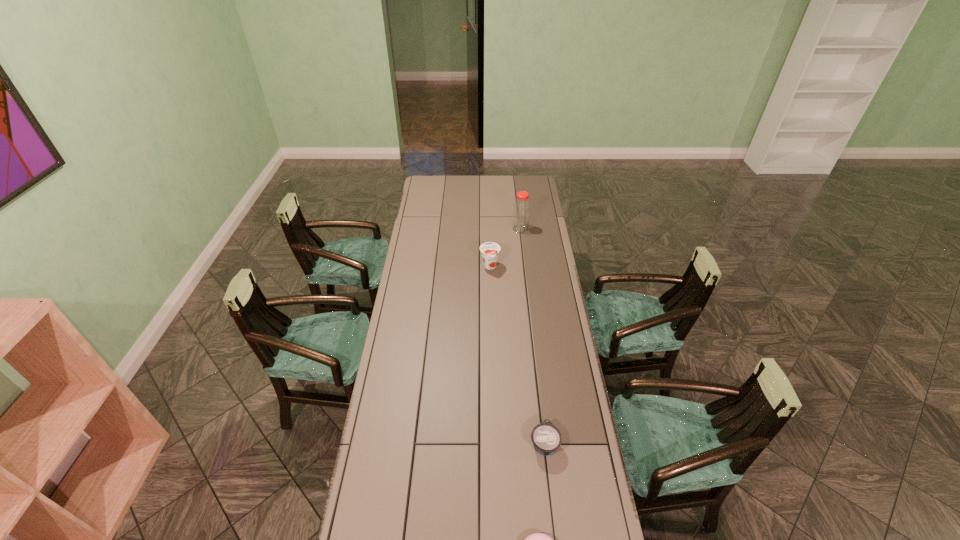
Where is `the tallest object`? The image size is (960, 540). the tallest object is located at coordinates (521, 212).

The width and height of the screenshot is (960, 540). I want to click on the farthest object, so click(521, 212).

Locate an element on the screen. the farther yogurt is located at coordinates (489, 250).

Locate an element on the screen. The image size is (960, 540). the leftmost object is located at coordinates (489, 250).

Locate an element on the screen. The width and height of the screenshot is (960, 540). the shorter yogurt is located at coordinates (546, 438).

The height and width of the screenshot is (540, 960). In order to click on the second shortest object in this screenshot , I will do `click(546, 438)`.

What are the coordinates of `free location located 0.240m on the front of the bottle` in the screenshot? It's located at (524, 262).

Image resolution: width=960 pixels, height=540 pixels. Identify the location of free space located on the back of the third shortest object. (490, 244).

Where is `vacant space located on the front of the nearer yogurt`? Image resolution: width=960 pixels, height=540 pixels. vacant space located on the front of the nearer yogurt is located at coordinates (551, 501).

The width and height of the screenshot is (960, 540). Find the location of `bottle that is at the right edge`. bottle that is at the right edge is located at coordinates (521, 212).